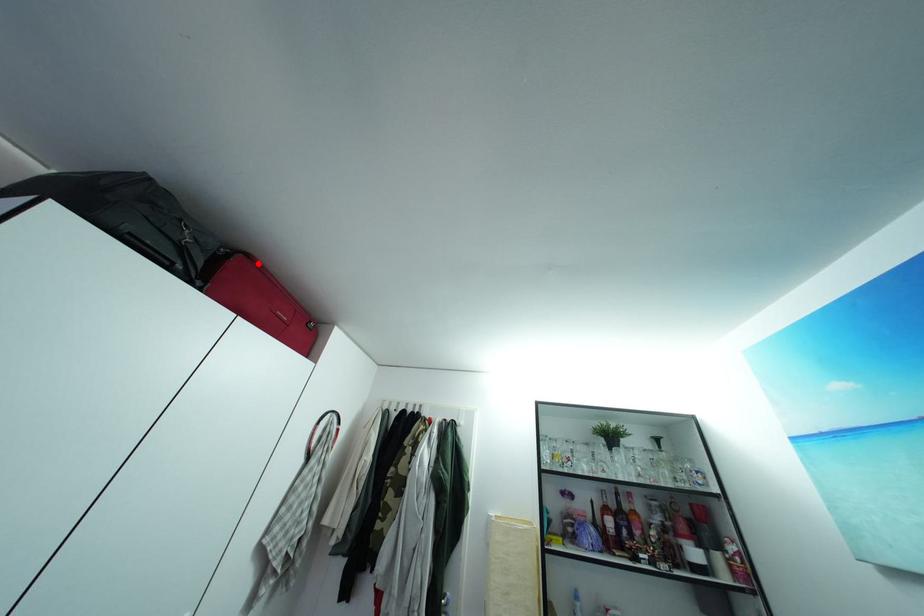
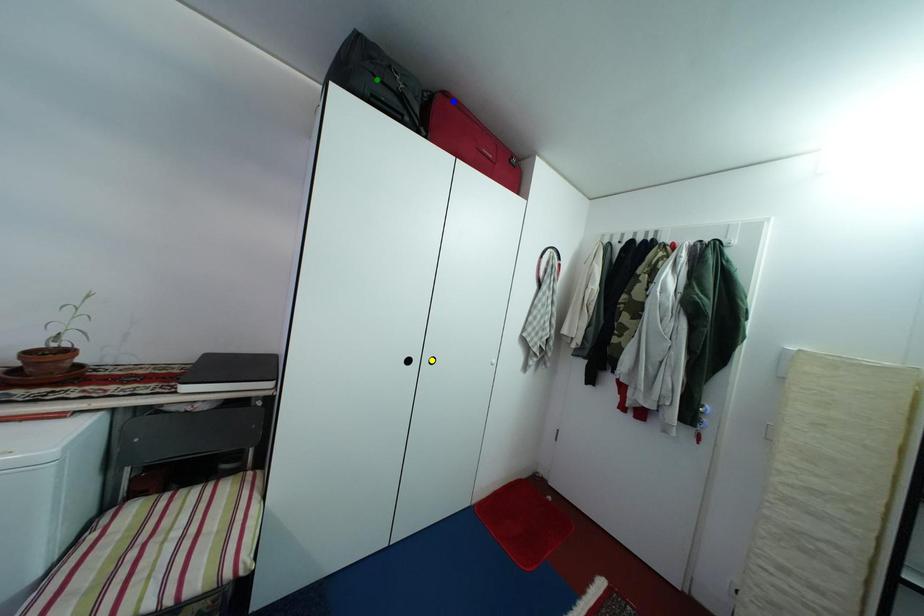
Question: I am providing you with two images of the same scene from different viewpoints. A red point is marked on the first image. You are given multiple points on the second image. In image 2, which mark is for the same physical point as the one in image 1?

Choices:
 (A) green point
 (B) blue point
 (C) yellow point

Answer: (B)